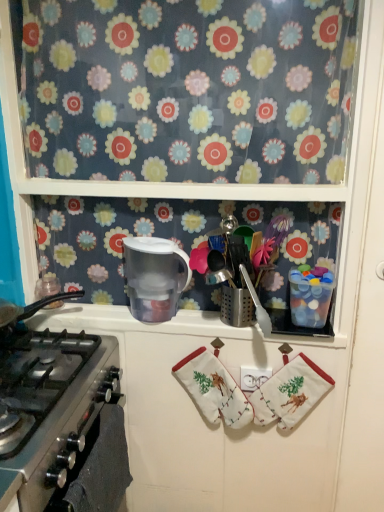
You are a GUI agent. You are given a task and a screenshot of the screen. Output one action in this format:
    pyautogui.click(x=<x>, y=<y>)
    Task: Click on the vacant region above translucent plastic water filter at center (from a real-world perspective)
    The width and height of the screenshot is (384, 512).
    Given the screenshot: What is the action you would take?
    pyautogui.click(x=150, y=315)